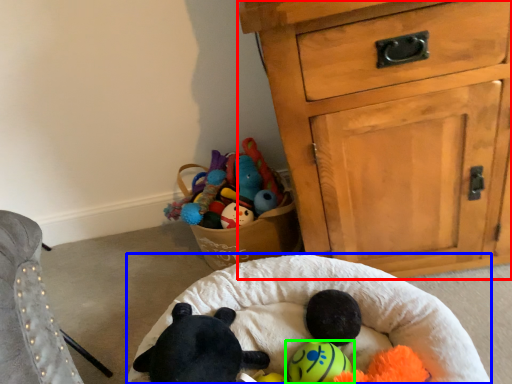
Question: Estimate the real-world distances between objects in this image. Which object is farther from chest of drawers (highlighted by a red box), infant bed (highlighted by a blue box) or toy (highlighted by a green box)?

Choices:
 (A) infant bed
 (B) toy

Answer: (B)